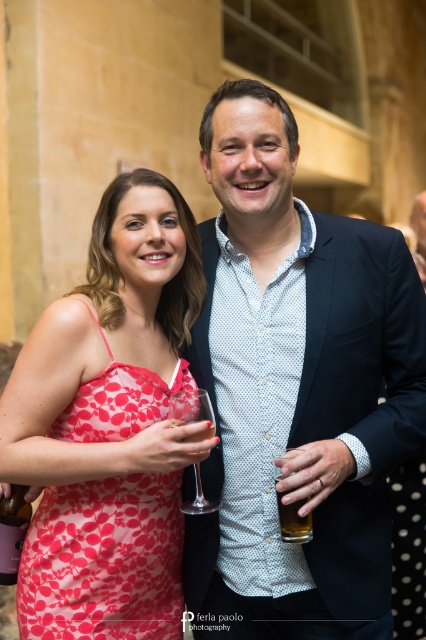
Which is behind, point (210, 417) or point (290, 529)?

The point (210, 417) is behind.

Can you confirm if clear glass wine glass at center is positioned to the left of translucent glass beer at center?

Yes, clear glass wine glass at center is to the left of translucent glass beer at center.

Which is in front, point (201, 394) or point (278, 476)?

Point (278, 476) is more forward.

This screenshot has width=426, height=640. I want to click on clear glass wine glass at center, so click(x=192, y=410).

Who is more distant from viewer, (201, 417) or (23, 488)?

Point (23, 488)

Does clear glass wine glass at center have a larger size compared to clear glass wine at lower left?

Correct, clear glass wine glass at center is larger in size than clear glass wine at lower left.

What do you see at coordinates (192, 410) in the screenshot? The image size is (426, 640). I see `clear glass wine glass at center` at bounding box center [192, 410].

Find the location of a particular element. clear glass wine glass at center is located at coordinates (192, 410).

Is point (5, 528) farther from camera compared to point (301, 525)?

That is True.

Find the location of a particular element. clear glass wine at lower left is located at coordinates (13, 531).